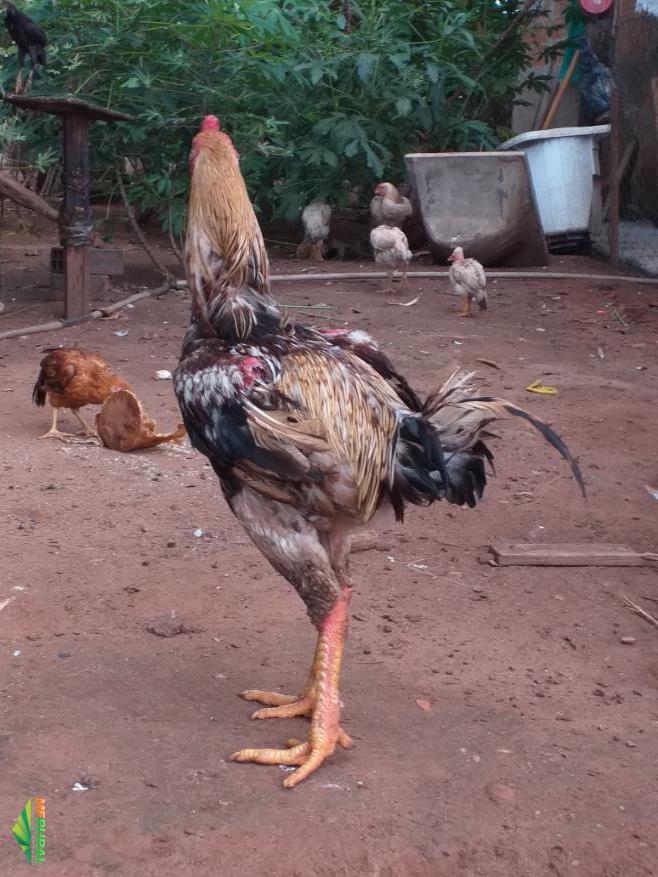
The height and width of the screenshot is (877, 658). I want to click on metal tub, so click(x=463, y=196).